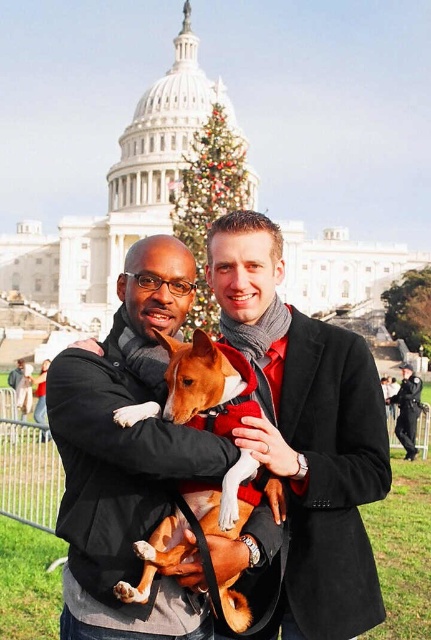
Based on the scene description, where is the brown furry dog at center located in the image?

The brown furry dog at center is located at point 0.605 on the x axis and 0.466 on the y axis.

You are standing in front of the United States Capitol building and see the matte black jacket at center and the green textured christmas tree at center. Which object is closer to the ground?

The matte black jacket at center is located below the green textured christmas tree at center, so it is closer to the ground.

You are standing at the United States Capitol building and want to take a photo of the Christmas tree. There are two points marked in the image. The first point is at coordinates point (x=71, y=442) and the second point is at coordinates point (x=194, y=246). Which point should you stand at to ensure the Christmas tree is fully visible in your photo?

You should stand at point (x=71, y=442) because it is in front of point (x=194, y=246), providing a clearer view of the Christmas tree.